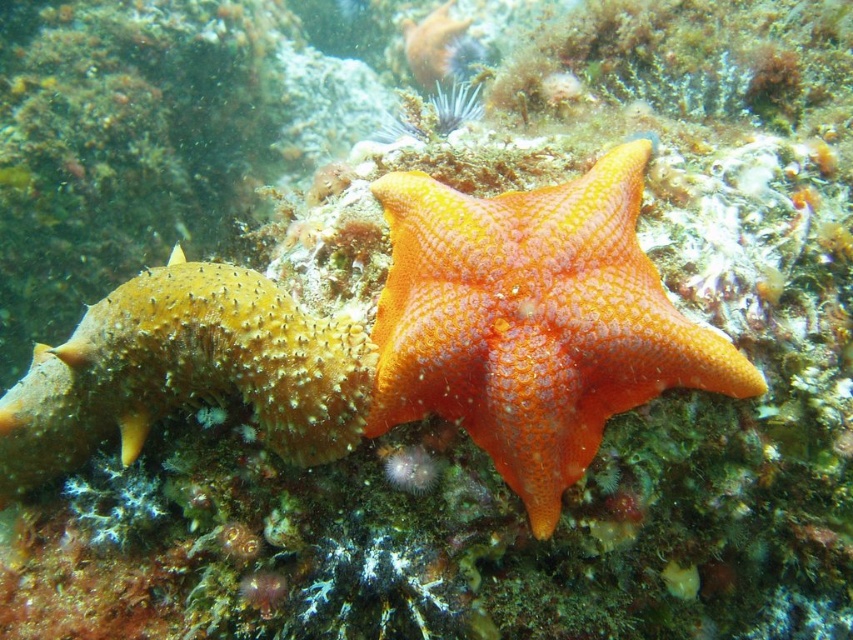
You are an underwater photographer aiming to capture both the orange rough starfish at center and the spongy orange starfish at center in a single frame. Which starfish will appear smaller in your photo?

The orange rough starfish at center is thinner than the spongy orange starfish at center, so it will appear smaller in the photo.

You are a marine biologist studying underwater coordinates. You observe an orange rough starfish at center in an underwater scene. What are its coordinates?

The orange rough starfish at center is located at coordinates point (x=532, y=321).

You are a marine biologist studying underwater life. You have a map that marks a point at coordinates (x=532, y=321). Based on the scene description, what marine creature is located at this point?

The point at coordinates (x=532, y=321) corresponds to the orange rough starfish at center.